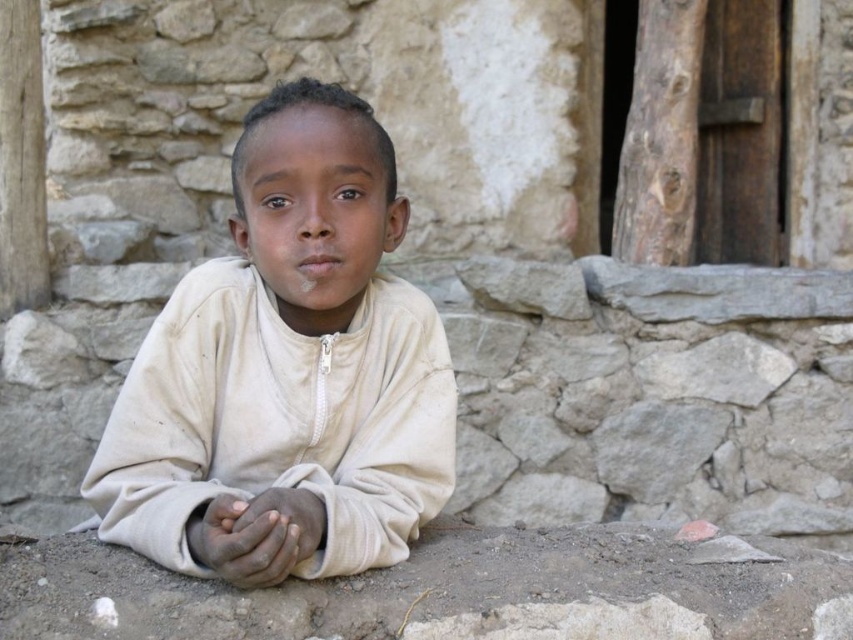
Question: Can you confirm if white matte shirt at center is wider than smooth skin hands at center?

Choices:
 (A) no
 (B) yes

Answer: (B)

Question: Considering the relative positions of white matte shirt at center and dark brown skin at center in the image provided, where is white matte shirt at center located with respect to dark brown skin at center?

Choices:
 (A) right
 (B) left

Answer: (A)

Question: Can you confirm if dark brown skin at center is wider than smooth skin hands at center?

Choices:
 (A) yes
 (B) no

Answer: (A)

Question: Estimate the real-world distances between objects in this image. Which object is closer to the dark brown skin at center?

Choices:
 (A) smooth skin hands at center
 (B) white matte shirt at center

Answer: (A)

Question: Which point is farther from the camera taking this photo?

Choices:
 (A) (280, 512)
 (B) (169, 388)

Answer: (B)

Question: Considering the real-world distances, which object is closest to the dark brown skin at center?

Choices:
 (A) white matte shirt at center
 (B) smooth skin hands at center

Answer: (B)